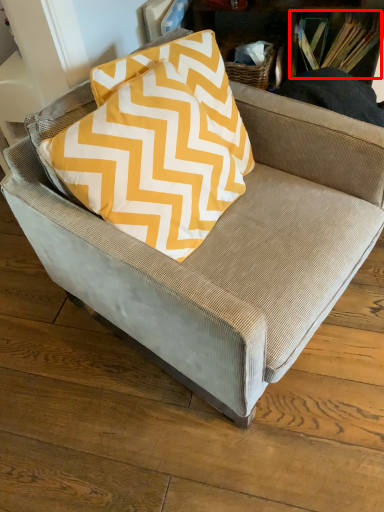
Question: In this image, where is book (annotated by the red box) located relative to pillow?

Choices:
 (A) left
 (B) right

Answer: (B)